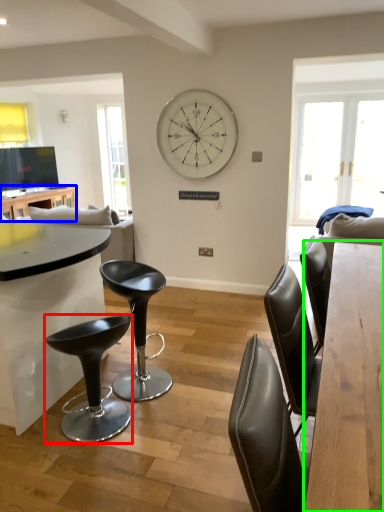
Question: Which object is the farthest from bar stool (highlighted by a red box)? Choose among these: table (highlighted by a blue box) or table (highlighted by a green box).

Choices:
 (A) table
 (B) table

Answer: (A)